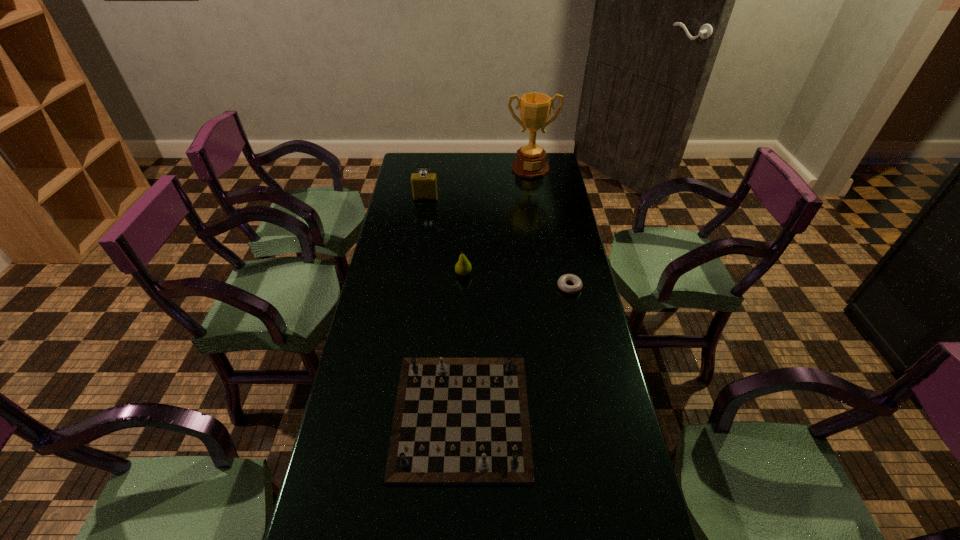
The width and height of the screenshot is (960, 540). I want to click on free area in between the fourth nearest object and the shortest object, so click(x=497, y=242).

Where is `empty space that is in between the fourth shortest object and the third shortest object`? The width and height of the screenshot is (960, 540). empty space that is in between the fourth shortest object and the third shortest object is located at coordinates (444, 236).

Locate an element on the screen. The width and height of the screenshot is (960, 540). the fourth closest object to the doughnut is located at coordinates tap(535, 108).

Image resolution: width=960 pixels, height=540 pixels. What are the coordinates of `object that is the third closest one to the pear` in the screenshot? It's located at (424, 186).

In order to click on vacant region that satisfies the following two spatial constraints: 1. on the front-facing side of the tallest object; 2. on the left side of the shortest object in this screenshot , I will do `click(549, 287)`.

The height and width of the screenshot is (540, 960). What are the coordinates of `free space that satisfies the following two spatial constraints: 1. on the front-facing side of the tallest object; 2. on the right side of the doughnut` in the screenshot? It's located at (549, 287).

You are a GUI agent. You are given a task and a screenshot of the screen. Output one action in this format:
    pyautogui.click(x=<x>, y=<y>)
    Task: Click on the free region that satisfies the following two spatial constraints: 1. on the front-facing side of the doughnut; 2. on the left side of the award
    The image size is (960, 540).
    Given the screenshot: What is the action you would take?
    pyautogui.click(x=549, y=287)

At what (x,y) coordinates should I click in order to perform the action: click on vacant region that satisfies the following two spatial constraints: 1. on the front-facing side of the farthest object; 2. on the right side of the doughnut. Please return your answer as a coordinate pair (x, y). The image size is (960, 540). Looking at the image, I should click on (549, 287).

Find the location of a particular element. The height and width of the screenshot is (540, 960). free space that satisfies the following two spatial constraints: 1. on the front side of the doughnut; 2. on the right side of the pear is located at coordinates (463, 287).

Image resolution: width=960 pixels, height=540 pixels. Identify the location of vacant area in the image that satisfies the following two spatial constraints: 1. on the front-facing side of the doughnut; 2. on the left side of the perfume. (412, 287).